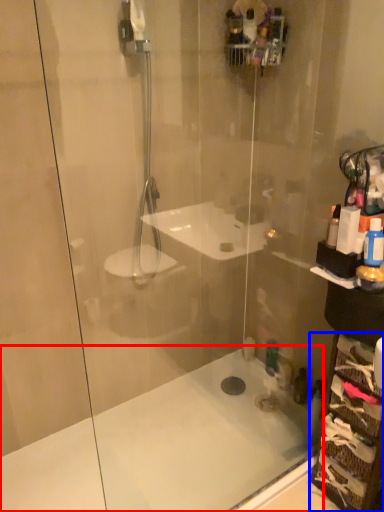
Question: Which object is closer to the camera taking this photo, bath (highlighted by a red box) or glass box (highlighted by a blue box)?

Choices:
 (A) bath
 (B) glass box

Answer: (A)